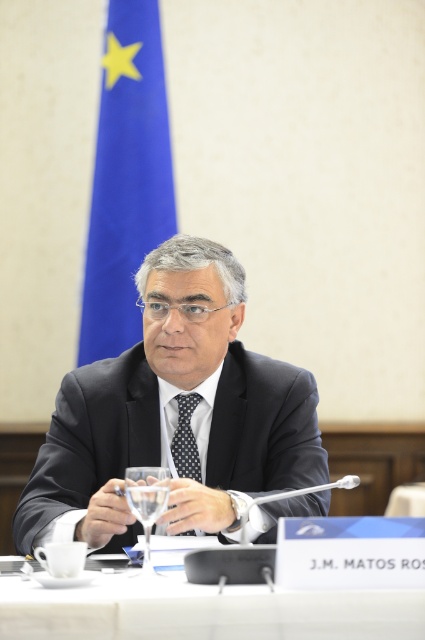
Between white glossy table at center and clear glass wine glass at center, which one has less height?

With less height is white glossy table at center.

Which is above, white glossy table at center or clear glass wine glass at center?

clear glass wine glass at center is above.

Measure the distance between point (118, 609) and camera.

Point (118, 609) is 1.16 meters away from camera.

This screenshot has width=425, height=640. In order to click on white glossy table at center in this screenshot , I will do `click(200, 611)`.

Does clear glass wine glass at center have a greater height compared to polka dot silk tie at center?

No.

The width and height of the screenshot is (425, 640). What do you see at coordinates (147, 500) in the screenshot?
I see `clear glass wine glass at center` at bounding box center [147, 500].

In order to click on clear glass wine glass at center in this screenshot , I will do `click(147, 500)`.

Based on the photo, is blue fabric flag at upper left wider than polka dot silk tie at center?

Correct, the width of blue fabric flag at upper left exceeds that of polka dot silk tie at center.

Is point (107, 346) more distant than point (181, 397)?

That is True.

Locate an element on the screen. blue fabric flag at upper left is located at coordinates (125, 179).